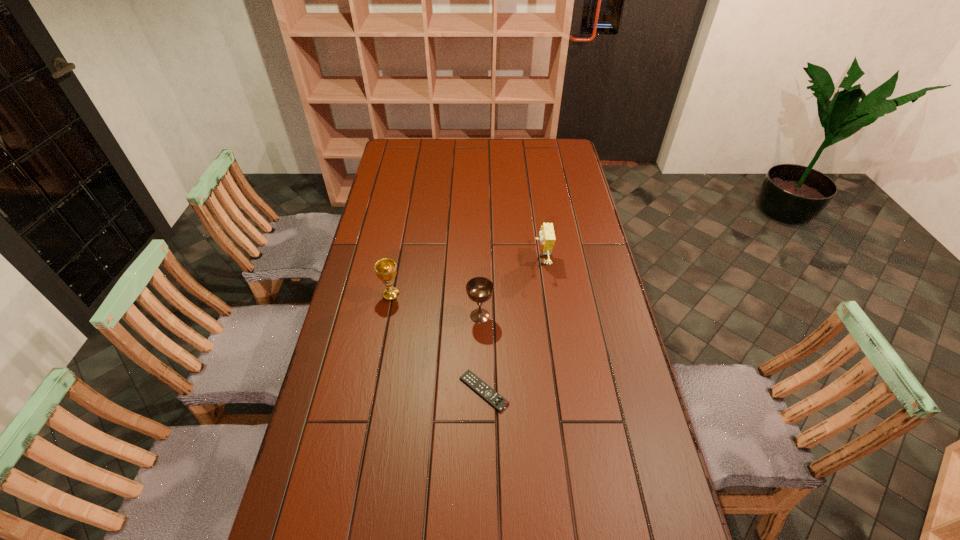
Identify the location of blank space located 0.130m on the face of the farthest object. (498, 261).

This screenshot has width=960, height=540. I want to click on vacant space positioned 0.120m on the front of the third nearest object, so click(x=385, y=332).

What are the coordinates of `vacant area located 0.100m on the left of the right chalice` in the screenshot? It's located at (437, 316).

The width and height of the screenshot is (960, 540). Identify the location of vacant space positioned 0.170m on the left of the shortest object. (400, 391).

In order to click on object that is at the left edge in this screenshot , I will do `click(385, 268)`.

Identify the location of free space at the far edge of the desktop. (485, 143).

Where is `vacant space at the left edge of the desktop`? vacant space at the left edge of the desktop is located at coordinates (325, 388).

In the image, there is a desktop. Find the location of `vacant space at the right edge`. vacant space at the right edge is located at coordinates (565, 249).

Locate an element on the screen. The image size is (960, 540). free space at the far right corner is located at coordinates (541, 150).

The height and width of the screenshot is (540, 960). I want to click on unoccupied position between the remote control and the second nearest object, so click(x=482, y=354).